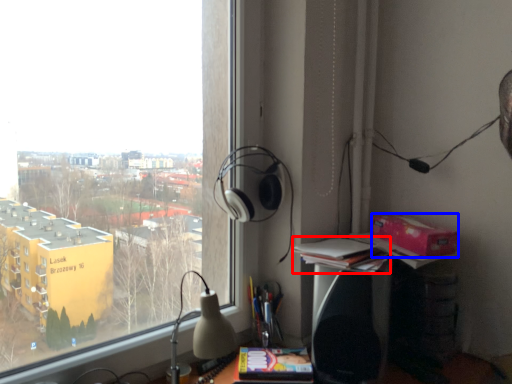
Question: Which of the following is the closest to the observer, book (highlighted by a red box) or cardboard box (highlighted by a blue box)?

Choices:
 (A) book
 (B) cardboard box

Answer: (A)